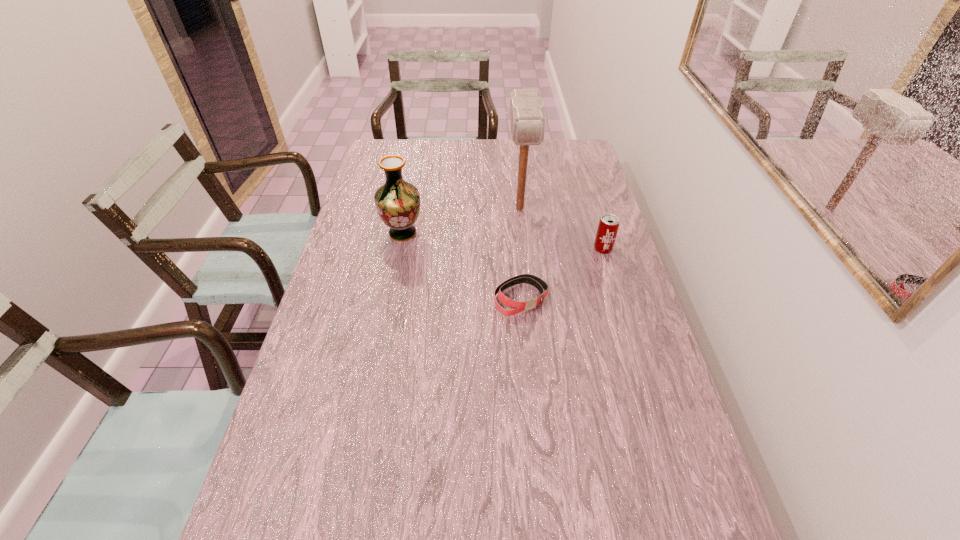
Locate an element on the screen. The image size is (960, 540). the tallest object is located at coordinates (527, 118).

This screenshot has width=960, height=540. In order to click on vase in this screenshot , I will do `click(397, 202)`.

Find the location of a particular element. Image resolution: width=960 pixels, height=540 pixels. the leftmost object is located at coordinates (397, 202).

This screenshot has width=960, height=540. I want to click on beer can, so click(x=608, y=226).

I want to click on the rightmost object, so click(608, 226).

Where is `the shortest object`? The image size is (960, 540). the shortest object is located at coordinates (517, 307).

Image resolution: width=960 pixels, height=540 pixels. What are the coordinates of `the nearest object` in the screenshot? It's located at (517, 307).

This screenshot has width=960, height=540. I want to click on vacant space located 0.160m on the striking face of the tallest object, so click(x=525, y=257).

Locate an element on the screen. free space located 0.060m on the back of the leftmost object is located at coordinates point(407,210).

This screenshot has width=960, height=540. In order to click on vacant space situated on the left of the rightmost object in this screenshot , I will do `click(565, 249)`.